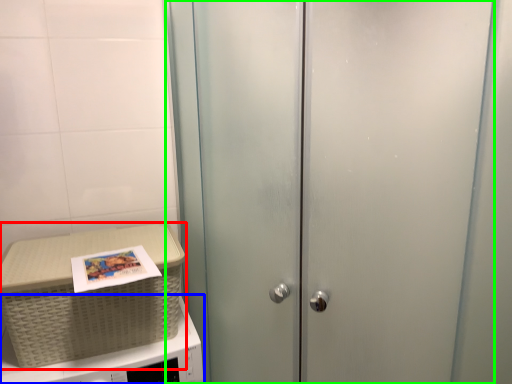
Question: Estimate the real-world distances between objects in this image. Which object is farther from picnic basket (highlighted by a red box), microwave oven (highlighted by a blue box) or door (highlighted by a green box)?

Choices:
 (A) microwave oven
 (B) door

Answer: (B)